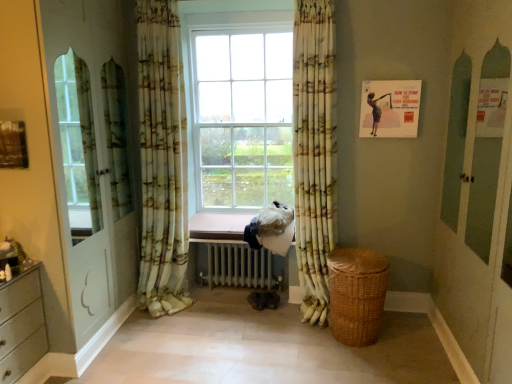
You are a GUI agent. You are given a task and a screenshot of the screen. Output one action in this format:
    pyautogui.click(x=<x>, y=<y>)
    Task: Click on the empty space that is ontop of woven brown basket at lower right (from a real-world perspective)
    
    Given the screenshot: What is the action you would take?
    pyautogui.click(x=353, y=258)